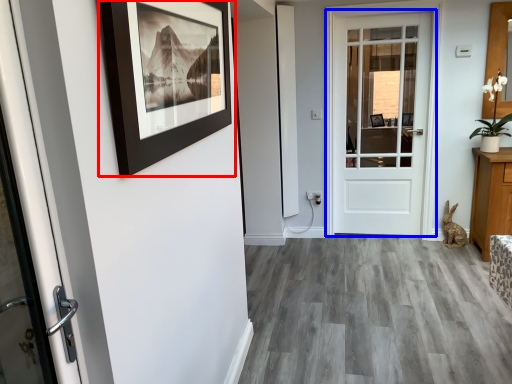
Question: Among these objects, which one is farthest to the camera, picture frame (highlighted by a red box) or door (highlighted by a blue box)?

Choices:
 (A) picture frame
 (B) door

Answer: (B)